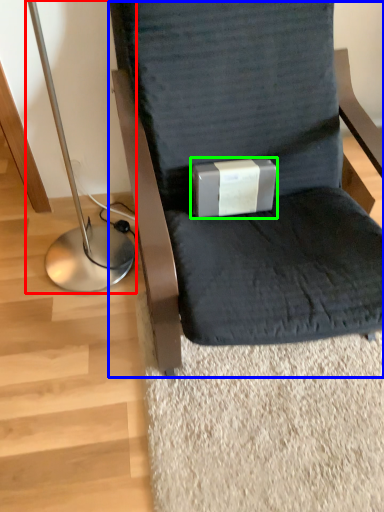
Question: Considering the real-world distances, which object is farthest from bedside lamp (highlighted by a red box)? chair (highlighted by a blue box) or box (highlighted by a green box)?

Choices:
 (A) chair
 (B) box

Answer: (A)